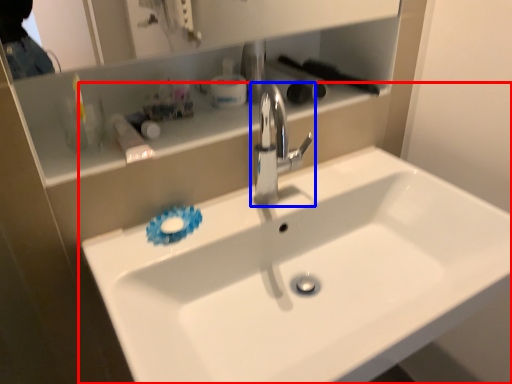
Question: Which of the following is the closest to the observer, sink (highlighted by a red box) or tap (highlighted by a blue box)?

Choices:
 (A) sink
 (B) tap

Answer: (A)